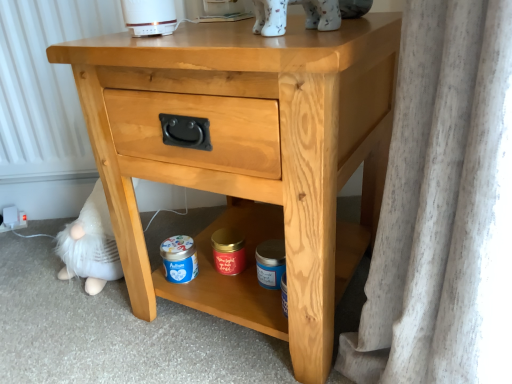
Describe the element at coordinates (270, 263) in the screenshot. This screenshot has height=384, width=512. I see `blue matte jar at lower center, acting as the 2th pottery starting from the left` at that location.

In order to face red matte candle at center, the 1th pottery from the left, should I rotate leftwards or rightwards?

To align with it, rotate left about 4.378°.

The width and height of the screenshot is (512, 384). What do you see at coordinates (228, 251) in the screenshot?
I see `red matte candle at center, the 1th pottery from the left` at bounding box center [228, 251].

Where is `light wood nightstand at center`? This screenshot has height=384, width=512. light wood nightstand at center is located at coordinates (248, 157).

You are a GUI agent. You are given a task and a screenshot of the screen. Output one action in this format:
    pyautogui.click(x=<x>, y=<y>)
    Task: Click on the white porcelain cat at upper center
    
    Given the screenshot: What is the action you would take?
    pyautogui.click(x=286, y=15)

Is blue matte jar at lower center, acting as the 2th pottery starting from the left, located outside red matte candle at center, placed as the second pottery when sorted from right to left?

Indeed, blue matte jar at lower center, acting as the 2th pottery starting from the left, is completely outside red matte candle at center, placed as the second pottery when sorted from right to left.

From the picture: Considering the positions of objects blue matte jar at lower center, acting as the 2th pottery starting from the left, and red matte candle at center, the 1th pottery from the left, in the image provided, who is more to the right, blue matte jar at lower center, acting as the 2th pottery starting from the left, or red matte candle at center, the 1th pottery from the left,?

blue matte jar at lower center, acting as the 2th pottery starting from the left, is more to the right.

In terms of size, does blue matte jar at lower center, acting as the 2th pottery starting from the left, appear bigger or smaller than red matte candle at center, the 1th pottery from the left?

In the image, blue matte jar at lower center, acting as the 2th pottery starting from the left, appears to be larger than red matte candle at center, the 1th pottery from the left.

How different are the orientations of blue matte jar at lower center, acting as the 2th pottery starting from the left, and red matte candle at center, the 1th pottery from the left, in degrees?

The angular difference between blue matte jar at lower center, acting as the 2th pottery starting from the left, and red matte candle at center, the 1th pottery from the left, is 0.000133 degrees.

Is light wood nightstand at center inside the boundaries of blue matte jar at lower center, or outside?

light wood nightstand at center is outside blue matte jar at lower center.

Which object is positioned more to the right, light wood nightstand at center or blue matte jar at lower center?

light wood nightstand at center.

Which of these two, light wood nightstand at center or blue matte jar at lower center, is wider?

Wider between the two is light wood nightstand at center.

Is light wood nightstand at center beside blue matte jar at lower center?

light wood nightstand at center is not next to blue matte jar at lower center, and they're not touching.

From the image's perspective, does white porcelain cat at upper center appear lower than blue matte jar at lower center?

No.

From a real-world perspective, is white porcelain cat at upper center located higher than blue matte jar at lower center?

Yes, from a real-world perspective, white porcelain cat at upper center is over blue matte jar at lower center

From their relative heights in the image, would you say white porcelain cat at upper center is taller or shorter than blue matte jar at lower center?

Considering their sizes, white porcelain cat at upper center has more height than blue matte jar at lower center.

Is white porcelain cat at upper center bigger or smaller than blue matte jar at lower center?

Clearly, white porcelain cat at upper center is larger in size than blue matte jar at lower center.

Which of these two, white porcelain cat at upper center or light wood nightstand at center, is thinner?

With smaller width is white porcelain cat at upper center.

Could you tell me if white porcelain cat at upper center is facing light wood nightstand at center?

No, white porcelain cat at upper center is not oriented towards light wood nightstand at center.

What are the coordinates of `nightstand on the left of white porcelain cat at upper center` in the screenshot? It's located at (248, 157).

Looking at their sizes, would you say light wood nightstand at center is wider or thinner than red matte candle at center, placed as the second pottery when sorted from right to left?

In the image, light wood nightstand at center appears to be wider than red matte candle at center, placed as the second pottery when sorted from right to left.

From the picture: Which is more to the left, light wood nightstand at center or red matte candle at center, placed as the second pottery when sorted from right to left?

Answer: red matte candle at center, placed as the second pottery when sorted from right to left, is more to the left.

Considering their positions, is light wood nightstand at center located in front of or behind red matte candle at center, placed as the second pottery when sorted from right to left?

Clearly, light wood nightstand at center is in front of red matte candle at center, placed as the second pottery when sorted from right to left.

Is point (155, 284) closer to camera compared to point (225, 236)?

Yes, point (155, 284) is closer to viewer.

Considering the relative sizes of white porcelain cat at upper center and red matte candle at center, the 1th pottery from the left, in the image provided, is white porcelain cat at upper center wider than red matte candle at center, the 1th pottery from the left,?

Correct, the width of white porcelain cat at upper center exceeds that of red matte candle at center, the 1th pottery from the left.

Which of these two, white porcelain cat at upper center or red matte candle at center, the 1th pottery from the left, is bigger?

With larger size is white porcelain cat at upper center.

Looking at this image, considering the positions of objects white porcelain cat at upper center and red matte candle at center, the 1th pottery from the left, in the image provided, who is more to the left, white porcelain cat at upper center or red matte candle at center, the 1th pottery from the left,?

red matte candle at center, the 1th pottery from the left.

Considering the relative sizes of light wood nightstand at center and blue matte jar at lower center, the first pottery from the right, in the image provided, is light wood nightstand at center taller than blue matte jar at lower center, the first pottery from the right,?

Yes, light wood nightstand at center is taller than blue matte jar at lower center, the first pottery from the right.

Do you think light wood nightstand at center is within blue matte jar at lower center, the first pottery from the right, or outside of it?

light wood nightstand at center is located beyond the bounds of blue matte jar at lower center, the first pottery from the right.

From the picture: Is light wood nightstand at center next to blue matte jar at lower center, the first pottery from the right, and touching it?

light wood nightstand at center and blue matte jar at lower center, the first pottery from the right, are not in contact.

What are the coordinates of `pottery lying below the red matte candle at center, the 1th pottery from the left (from the image's perspective)` in the screenshot? It's located at (270, 263).

In the image, there is a blue matte jar at lower center. At what (x,y) coordinates should I click in order to perform the action: click on nightstand above it (from the image's perspective). Please return your answer as a coordinate pair (x, y). Looking at the image, I should click on (248, 157).

Which object lies nearer to the anchor point red matte candle at center, the 1th pottery from the left, blue matte jar at lower center, the first pottery from the right, or white porcelain cat at upper center?

blue matte jar at lower center, the first pottery from the right, lies closer to red matte candle at center, the 1th pottery from the left, than the other object.

Looking at the image, which one is located closer to blue matte jar at lower center, the first pottery from the right, blue matte jar at lower center or white porcelain cat at upper center?

blue matte jar at lower center.

Looking at the image, which one is located further to red matte candle at center, placed as the second pottery when sorted from right to left, blue matte jar at lower center or light wood nightstand at center?

Among the two, light wood nightstand at center is located further to red matte candle at center, placed as the second pottery when sorted from right to left.

Estimate the real-world distances between objects in this image. Which object is further from white porcelain cat at upper center, light wood nightstand at center or red matte candle at center, the 1th pottery from the left?

Among the two, red matte candle at center, the 1th pottery from the left, is located further to white porcelain cat at upper center.

Which object lies nearer to the anchor point light wood nightstand at center, red matte candle at center, placed as the second pottery when sorted from right to left, or blue matte jar at lower center, the first pottery from the right?

blue matte jar at lower center, the first pottery from the right, is positioned closer to the anchor light wood nightstand at center.

Considering their positions, is blue matte jar at lower center positioned further to white porcelain cat at upper center than light wood nightstand at center?

The object further to white porcelain cat at upper center is blue matte jar at lower center.

Estimate the real-world distances between objects in this image. Which object is further from blue matte jar at lower center, acting as the 2th pottery starting from the left, light wood nightstand at center or white porcelain cat at upper center?

The object further to blue matte jar at lower center, acting as the 2th pottery starting from the left, is white porcelain cat at upper center.

Considering their positions, is light wood nightstand at center positioned further to blue matte jar at lower center, the first pottery from the right, than red matte candle at center, the 1th pottery from the left?

light wood nightstand at center lies further to blue matte jar at lower center, the first pottery from the right, than the other object.

The height and width of the screenshot is (384, 512). I want to click on animal positioned between light wood nightstand at center and red matte candle at center, placed as the second pottery when sorted from right to left, from near to far, so 286,15.

Image resolution: width=512 pixels, height=384 pixels. I want to click on pottery that lies between white porcelain cat at upper center and blue matte jar at lower center, acting as the 2th pottery starting from the left, from top to bottom, so click(228, 251).

This screenshot has height=384, width=512. Identify the location of glass jar that lies between white porcelain cat at upper center and blue matte jar at lower center, acting as the 2th pottery starting from the left, from top to bottom. (179, 259).

Find the location of `pottery between white porcelain cat at upper center and blue matte jar at lower center from top to bottom`. pottery between white porcelain cat at upper center and blue matte jar at lower center from top to bottom is located at coordinates pos(228,251).